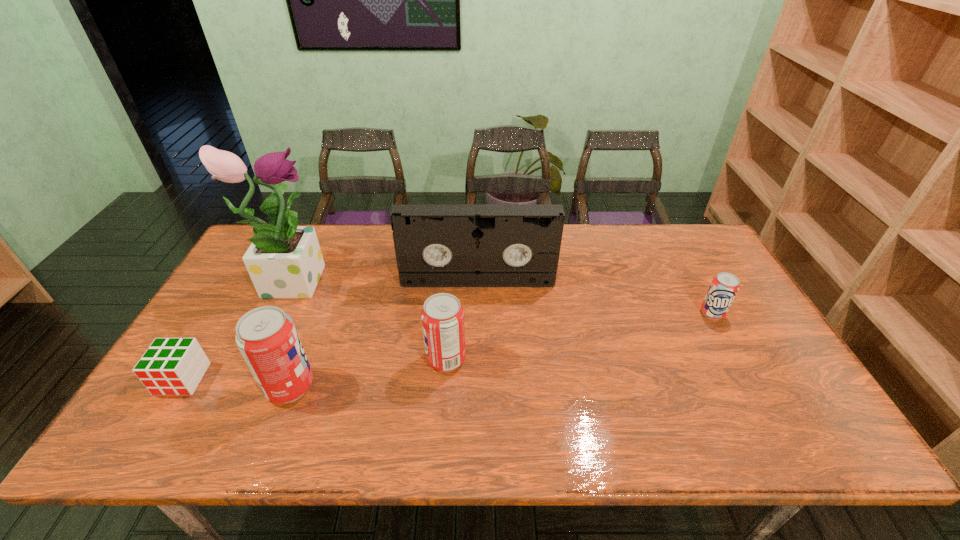
What are the coordinates of `free space located on the left of the shortest soda can` in the screenshot? It's located at (582, 313).

The width and height of the screenshot is (960, 540). Identify the location of vacant area located on the front-facing side of the tallest object. (393, 278).

Identify the location of free space located 0.390m on the side of the videotape with visible spindles. (477, 397).

This screenshot has height=540, width=960. Find the location of `object located in the far edge section of the desktop`. object located in the far edge section of the desktop is located at coordinates (284, 261).

You are a GUI agent. You are given a task and a screenshot of the screen. Output one action in this format:
    pyautogui.click(x=<x>, y=<y>)
    Task: Click on the soda can that is positioned at the near edge
    This screenshot has height=540, width=960.
    Given the screenshot: What is the action you would take?
    pyautogui.click(x=267, y=338)

Find the location of a particular element. Image resolution: width=960 pixels, height=540 pixels. cube that is at the near edge is located at coordinates (170, 366).

At what (x,y) coordinates should I click in order to perform the action: click on flower arrangement located at the left edge. Please return your answer as a coordinate pair (x, y). The width and height of the screenshot is (960, 540). Looking at the image, I should click on coord(284,261).

Locate an element on the screen. This screenshot has height=540, width=960. cube located at the left edge is located at coordinates (170, 366).

At what (x,y) coordinates should I click in order to perform the action: click on object located at the right edge. Please return your answer as a coordinate pair (x, y). Image resolution: width=960 pixels, height=540 pixels. Looking at the image, I should click on (724, 287).

Image resolution: width=960 pixels, height=540 pixels. I want to click on object present at the far left corner, so click(x=284, y=261).